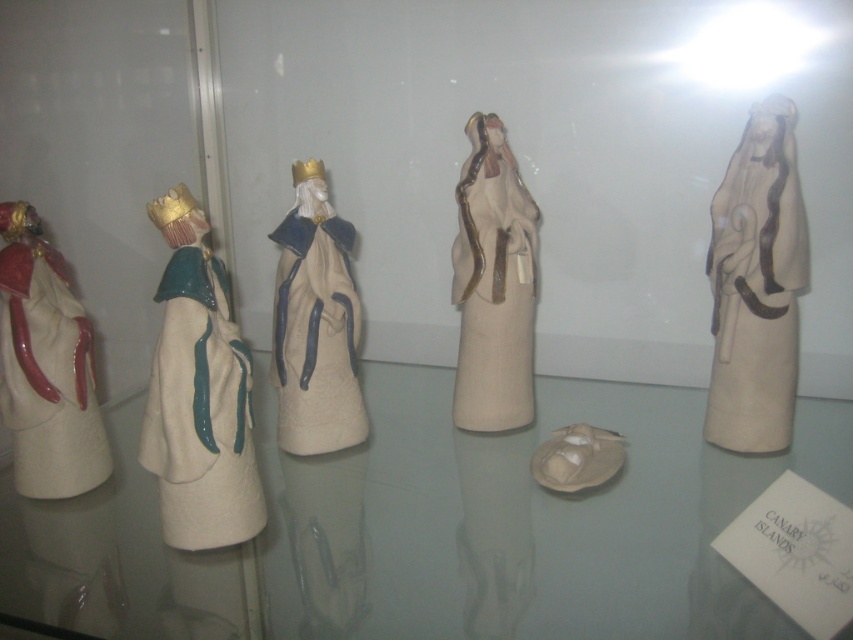
Does transparent glass table at center appear on the right side of matte beige figurine at center?

Incorrect, transparent glass table at center is not on the right side of matte beige figurine at center.

Does transparent glass table at center have a smaller size compared to matte beige figurine at center?

No.

At what (x,y) coordinates should I click in order to perform the action: click on transparent glass table at center. Please return your answer as a coordinate pair (x, y). This screenshot has width=853, height=640. Looking at the image, I should click on (521, 518).

Find the location of a particular element. The image size is (853, 640). transparent glass table at center is located at coordinates (521, 518).

Who is taller, matte white porcelain figurine at left or matte beige statue at right?

matte beige statue at right

Does matte white porcelain figurine at left have a lesser height compared to matte beige statue at right?

Yes, matte white porcelain figurine at left is shorter than matte beige statue at right.

Who is more distant from viewer, [210,368] or [756,177]?

The point [756,177] is behind.

I want to click on matte white porcelain figurine at left, so click(199, 394).

Who is lower down, matte white porcelain figurine at left or matte red fabric at left?

matte white porcelain figurine at left

Is point (175, 500) closer to camera compared to point (10, 209)?

Yes, point (175, 500) is in front of point (10, 209).

Is point (178, 490) farther from camera compared to point (73, 493)?

That is False.

This screenshot has width=853, height=640. What are the coordinates of `matte white porcelain figurine at left` in the screenshot? It's located at 199,394.